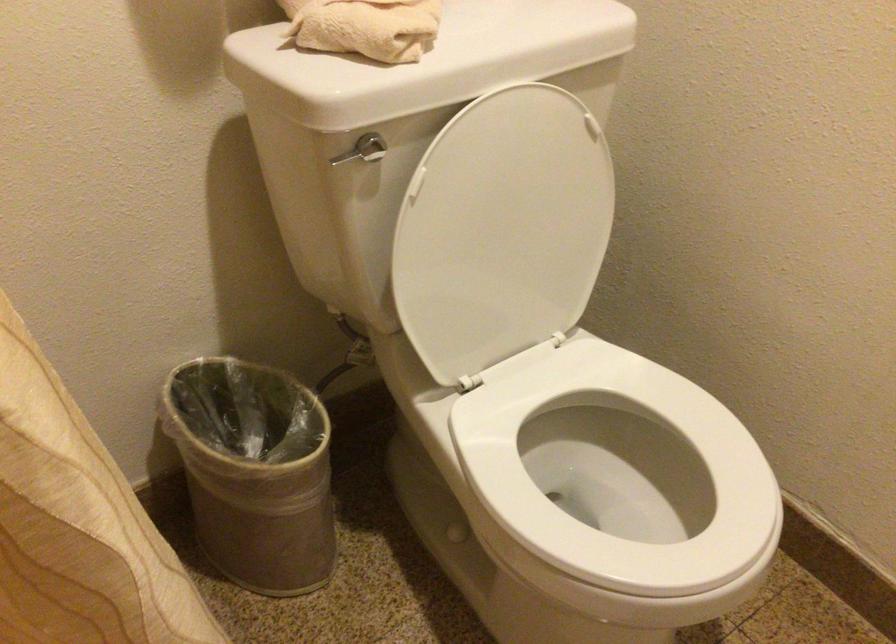
The location [254,471] corresponds to which object?

It refers to a small trash can.